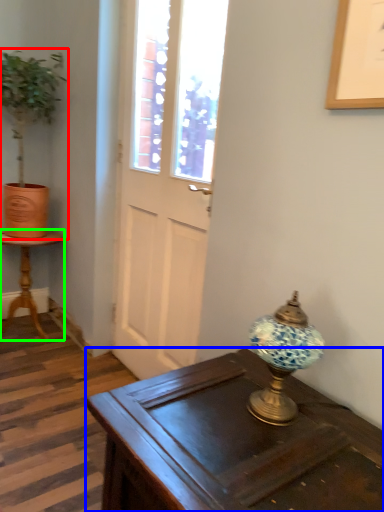
Question: Considering the real-world distances, which object is closest to houseplant (highlighted by a red box)? desk (highlighted by a blue box) or table (highlighted by a green box).

Choices:
 (A) desk
 (B) table

Answer: (B)